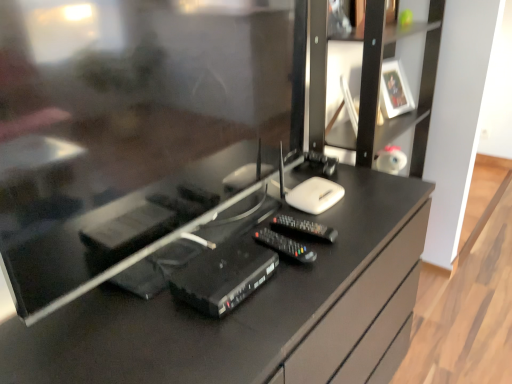
The width and height of the screenshot is (512, 384). In order to click on unoccupied region to the right of black plastic router at center, placed as the 2th equipment when sorted from right to left in this screenshot , I will do `click(307, 280)`.